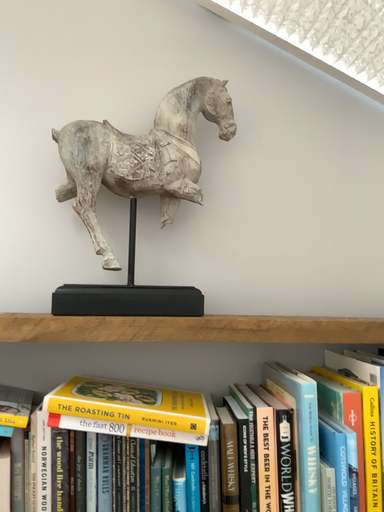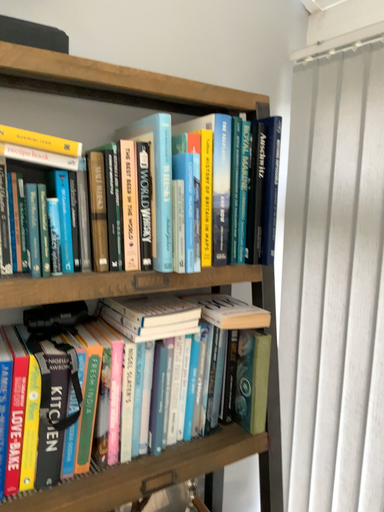
Question: Which way did the camera rotate in the video?

Choices:
 (A) rotated downward
 (B) rotated upward

Answer: (A)